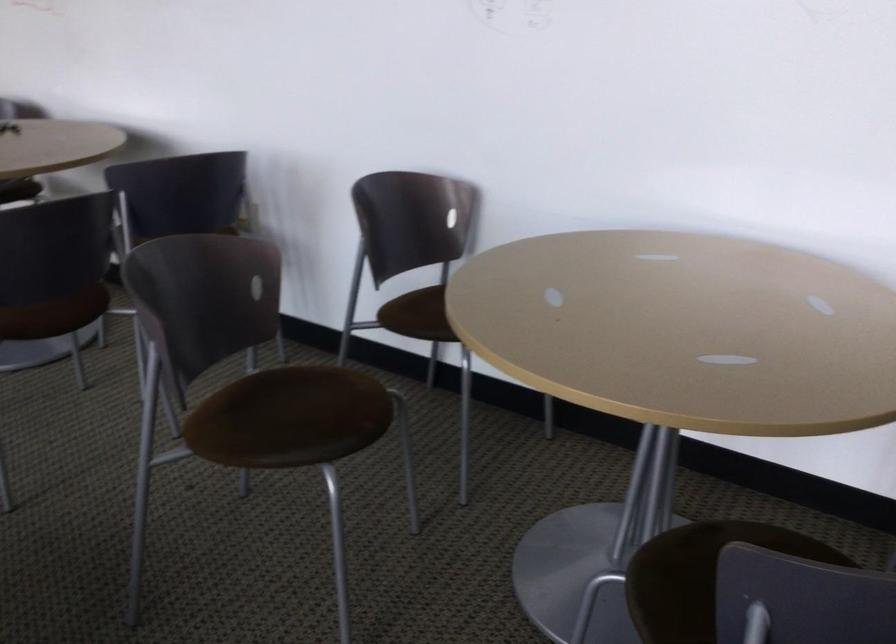
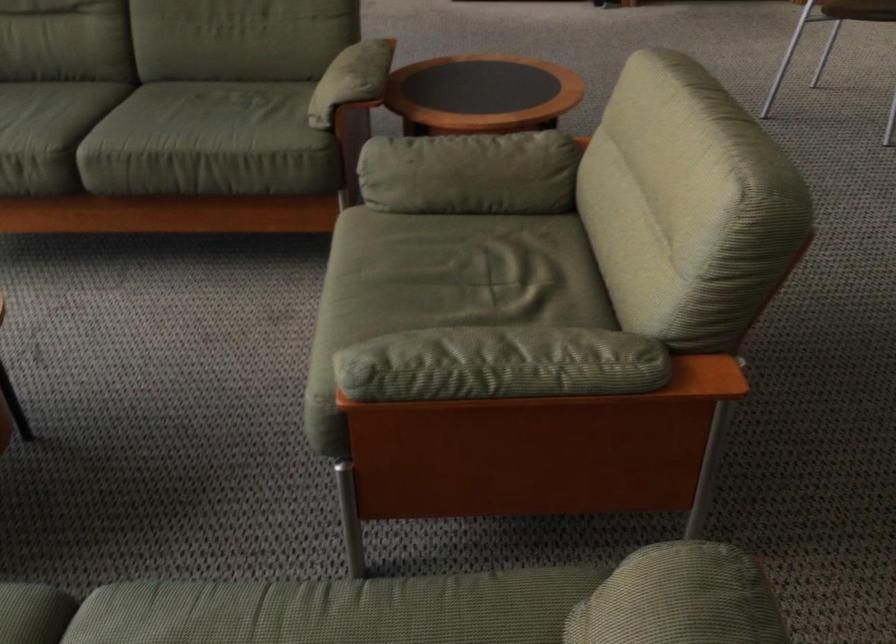
The images are taken continuously from a first-person perspective. In which direction is your viewpoint rotating?

The camera rotated toward left-down.